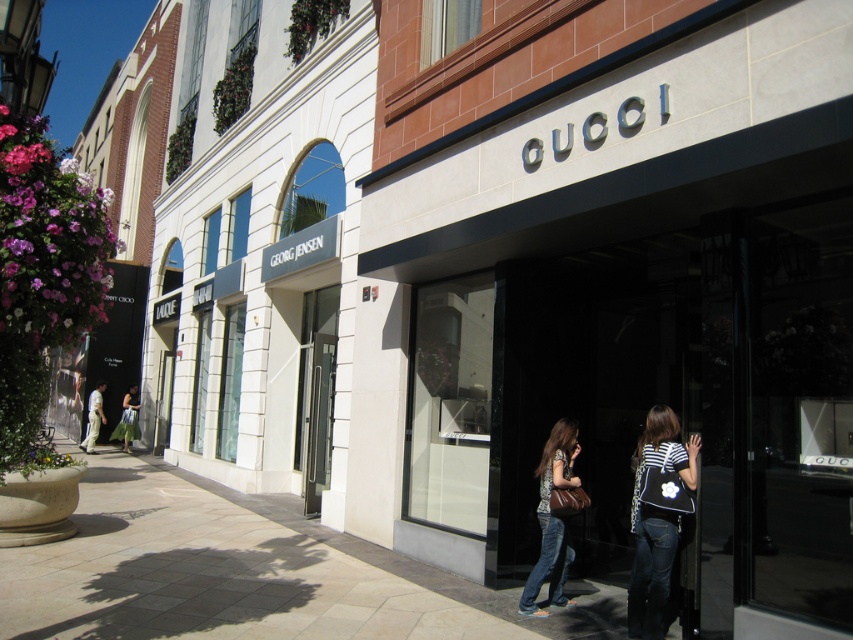
Who is positioned more to the left, light beige paving stone at lower center or denim at lower right?

From the viewer's perspective, light beige paving stone at lower center appears more on the left side.

Does point (308, 532) come closer to viewer compared to point (636, 528)?

No, (308, 532) is behind (636, 528).

At what (x,y) coordinates should I click in order to perform the action: click on light beige paving stone at lower center. Please return your answer as a coordinate pair (x, y). This screenshot has height=640, width=853. Looking at the image, I should click on (244, 573).

Can you confirm if light beige paving stone at lower center is bigger than jeans at lower center?

Indeed, light beige paving stone at lower center has a larger size compared to jeans at lower center.

At what (x,y) coordinates should I click in order to perform the action: click on light beige paving stone at lower center. Please return your answer as a coordinate pair (x, y). The width and height of the screenshot is (853, 640). Looking at the image, I should click on (244, 573).

Measure the distance from denim jeans at center to denim at lower right.

denim jeans at center and denim at lower right are 31.94 inches apart from each other.

The image size is (853, 640). What do you see at coordinates (552, 518) in the screenshot? I see `denim jeans at center` at bounding box center [552, 518].

Is point (534, 573) behind point (635, 580)?

Yes, it is.

You are a GUI agent. You are given a task and a screenshot of the screen. Output one action in this format:
    pyautogui.click(x=<x>, y=<y>)
    Task: Click on the denim jeans at center
    
    Given the screenshot: What is the action you would take?
    pyautogui.click(x=552, y=518)